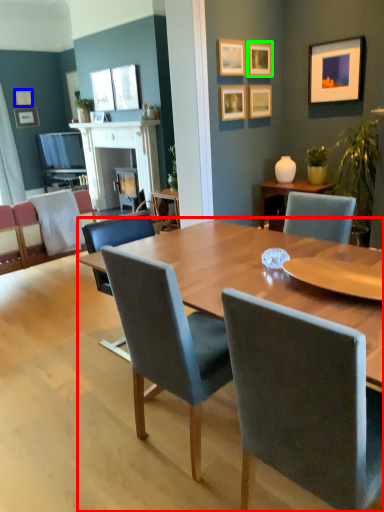
Question: Considering the real-world distances, which object is farthest from kitchen & dining room table (highlighted by a red box)? picture frame (highlighted by a blue box) or picture frame (highlighted by a green box)?

Choices:
 (A) picture frame
 (B) picture frame

Answer: (A)